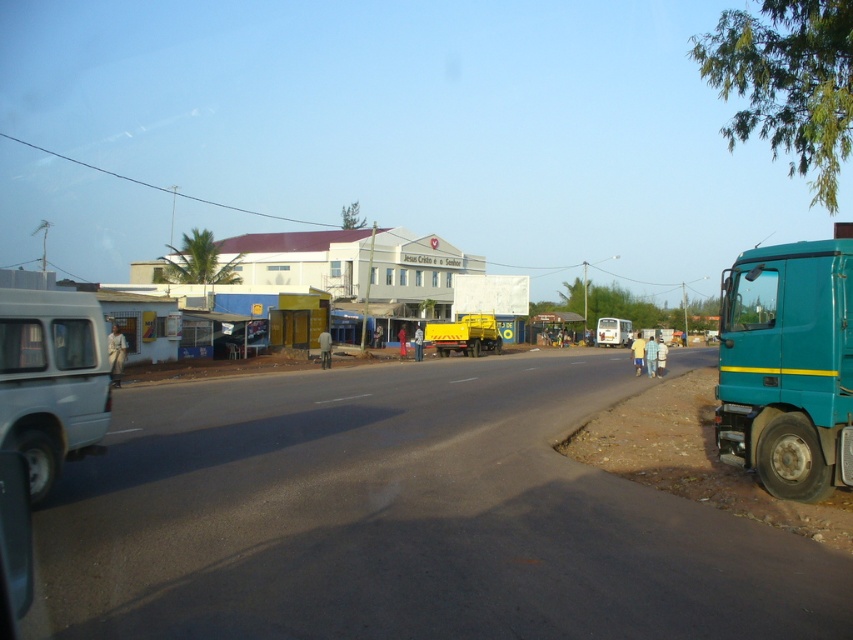
Question: Considering the relative positions of white matte building at center and yellow matte truck at center in the image provided, where is white matte building at center located with respect to yellow matte truck at center?

Choices:
 (A) above
 (B) below

Answer: (A)

Question: Which object is the closest to the teal matte truck at right?

Choices:
 (A) white matte building at center
 (B) yellow matte truck at center
 (C) white matte van at center

Answer: (B)

Question: Based on their relative distances, which object is nearer to the light blue matte van at left?

Choices:
 (A) white matte building at center
 (B) yellow matte truck at center

Answer: (B)

Question: Among these objects, which one is farthest from the camera?

Choices:
 (A) yellow matte truck at center
 (B) white matte building at center

Answer: (B)

Question: Does teal matte truck at right appear under light blue matte van at left?

Choices:
 (A) yes
 (B) no

Answer: (B)

Question: Does white matte building at center appear over white matte van at center?

Choices:
 (A) yes
 (B) no

Answer: (A)